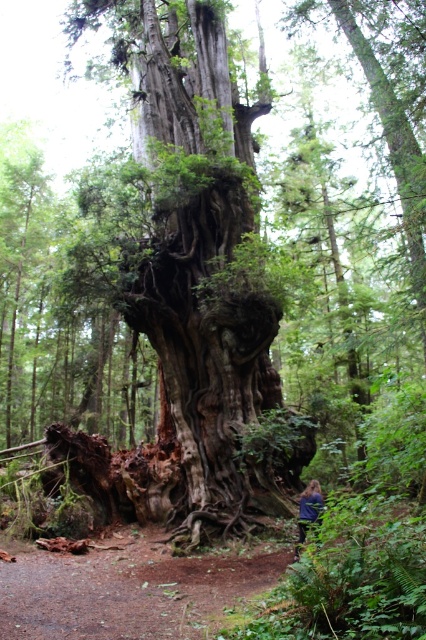
Question: Observing the image, what is the correct spatial positioning of rough bark tree trunk at center in reference to blue fabric at lower center?

Choices:
 (A) above
 (B) below

Answer: (A)

Question: Which point is farther to the camera?

Choices:
 (A) blue fabric at lower center
 (B) rough bark tree trunk at center

Answer: (B)

Question: Is the position of rough bark tree trunk at center less distant than that of blue fabric at lower center?

Choices:
 (A) no
 (B) yes

Answer: (A)

Question: Which of the following is the farthest from the observer?

Choices:
 (A) blue fabric at lower center
 (B) rough bark tree trunk at center

Answer: (B)

Question: Can you confirm if rough bark tree trunk at center is positioned to the left of blue fabric at lower center?

Choices:
 (A) yes
 (B) no

Answer: (A)